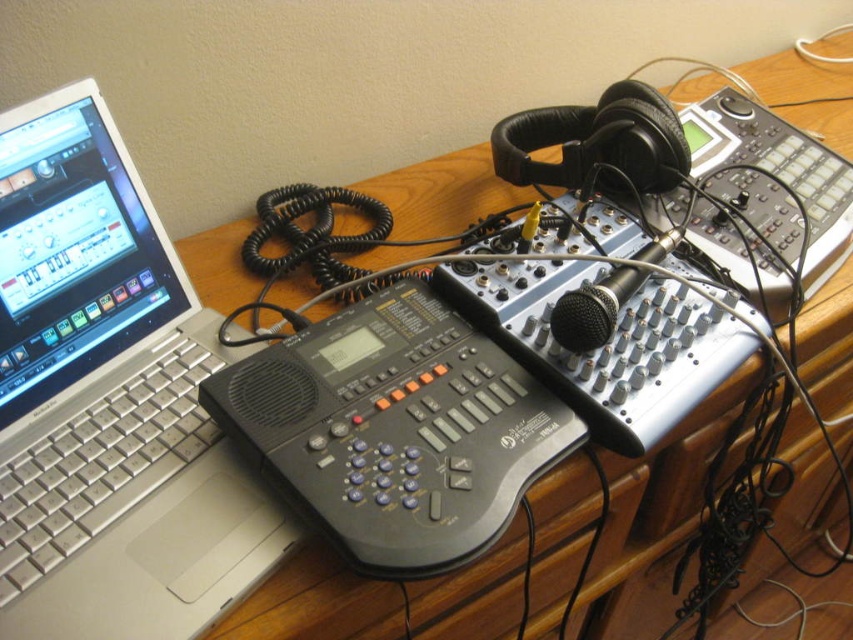
Question: Considering the relative positions of silver metallic laptop at left and wooden desk at center in the image provided, where is silver metallic laptop at left located with respect to wooden desk at center?

Choices:
 (A) right
 (B) left

Answer: (B)

Question: Is silver metallic laptop at left further to camera compared to wooden desk at center?

Choices:
 (A) no
 (B) yes

Answer: (A)

Question: Which object appears farthest from the camera in this image?

Choices:
 (A) silver metallic laptop at left
 (B) wooden desk at center

Answer: (B)

Question: Is silver metallic laptop at left thinner than wooden desk at center?

Choices:
 (A) no
 (B) yes

Answer: (B)